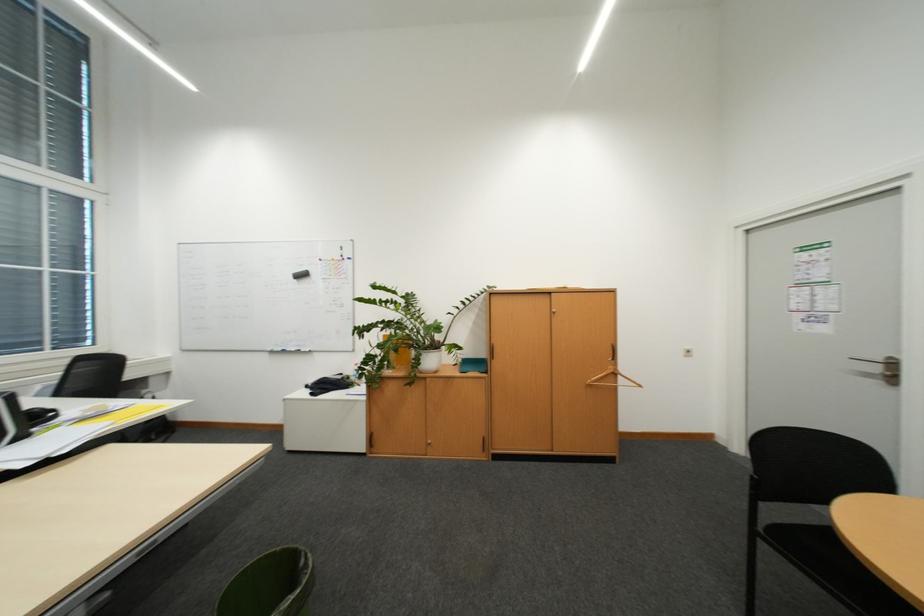
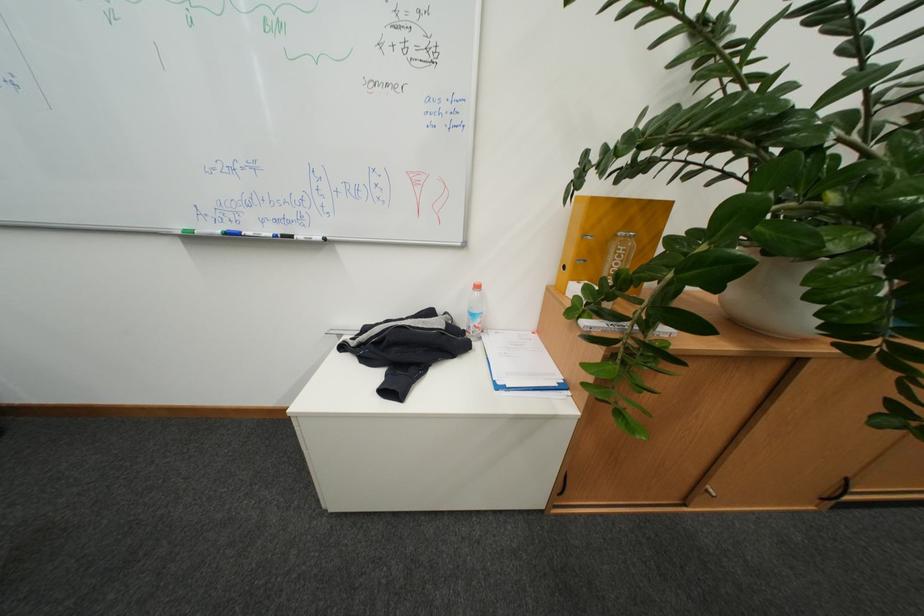
Which direction would the cameraman need to move to produce the second image?

The movement direction of the cameraman is left, forward.